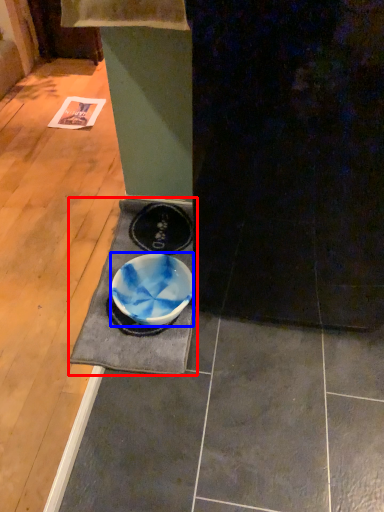
Question: Which of the following is the farthest to the observer, doormat (highlighted by a red box) or bowl (highlighted by a blue box)?

Choices:
 (A) doormat
 (B) bowl

Answer: (B)